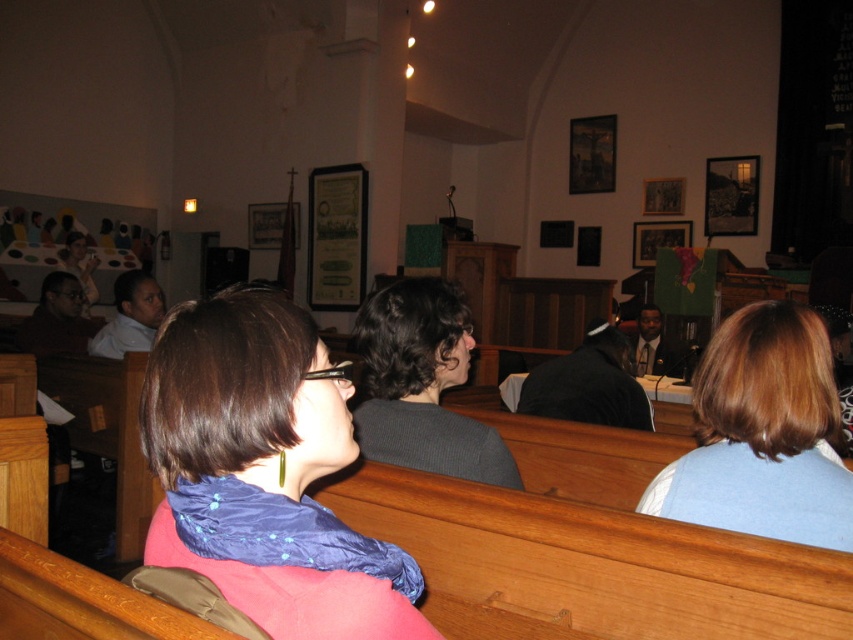
You are standing at the entrance of the church and want to see both the light brown hair at right and the matte black laptop at upper left. Can you see both objects at the same time without moving your head?

The light brown hair at right and the matte black laptop at upper left are 6.73 meters apart from each other. Since the distance between them is significant, it is possible to see both objects at the same time without moving your head, assuming your field of view can encompass 6.73 meters horizontally.

From the picture: You are sitting in the pew behind these two people and want to hand a note to the person with light brown hair at right without disturbing the person with the blue satin scarf at center. Which side should you approach from?

You should approach from the right side of the light brown hair at right because the blue satin scarf at center is on its left side, so the right side is farther away from the blue satin scarf at center and less likely to disturb them.

You are a photographer standing behind the camera. You want to take a closeup photo of the blue satin scarf at center. Can you do so without moving the camera?

The blue satin scarf at center and camera are 26.76 inches apart from each other, so yes, you can take a closeup photo of the blue satin scarf at center without moving the camera as the distance is manageable for a closeup shot.